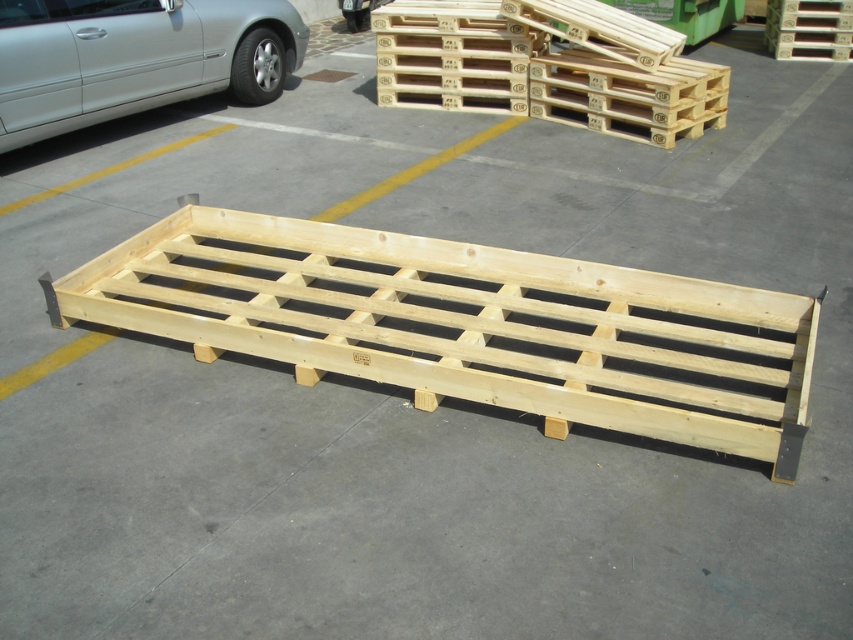
Is silver metallic car at left taller than natural wood pallet at upper right?

Indeed, silver metallic car at left has a greater height compared to natural wood pallet at upper right.

Which is below, silver metallic car at left or natural wood pallet at upper right?

silver metallic car at left is lower down.

Is point (189, 38) less distant than point (807, 32)?

That is True.

At what (x,y) coordinates should I click in order to perform the action: click on silver metallic car at left. Please return your answer as a coordinate pair (x, y). The width and height of the screenshot is (853, 640). Looking at the image, I should click on (135, 58).

Is natural wood pallet at center thinner than silver metallic car at left?

In fact, natural wood pallet at center might be wider than silver metallic car at left.

Can you confirm if natural wood pallet at center is taller than silver metallic car at left?

No.

Image resolution: width=853 pixels, height=640 pixels. Identify the location of natural wood pallet at center. click(x=468, y=324).

Which is behind, point (485, 268) or point (630, 100)?

The point (630, 100) is behind.

Is natural wood pallet at center thinner than natural wood pallet at upper center?

No.

Consider the image. Who is more forward, (163,323) or (408,3)?

Positioned in front is point (163,323).

This screenshot has width=853, height=640. Identify the location of natural wood pallet at center. (468, 324).